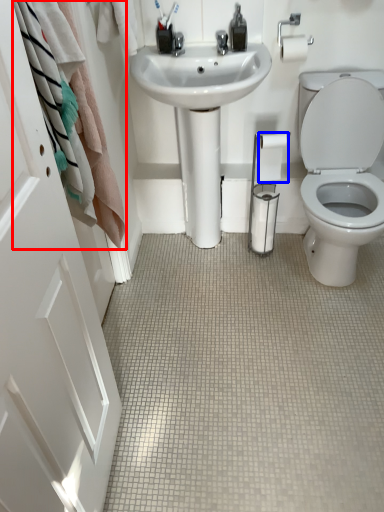
Question: Which object is closer to the camera taking this photo, bath towel (highlighted by a red box) or toilet paper (highlighted by a blue box)?

Choices:
 (A) bath towel
 (B) toilet paper

Answer: (A)